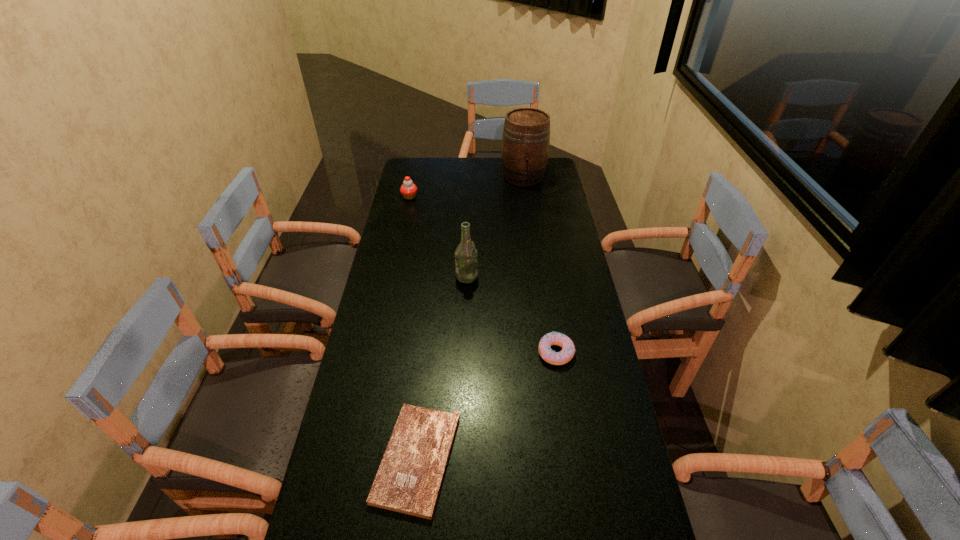
The image size is (960, 540). I want to click on cider, so click(x=526, y=135).

Where is `the farthest object`? the farthest object is located at coordinates (526, 135).

The width and height of the screenshot is (960, 540). In order to click on the fourth shortest object in this screenshot , I will do (x=466, y=262).

At what (x,y) coordinates should I click in order to perform the action: click on beer bottle. Please return your answer as a coordinate pair (x, y). Image resolution: width=960 pixels, height=540 pixels. Looking at the image, I should click on (466, 262).

Identify the location of the fourth nearest object. This screenshot has height=540, width=960. (408, 189).

I want to click on cupcake, so click(x=408, y=189).

Where is `the second nearest object`? The width and height of the screenshot is (960, 540). the second nearest object is located at coordinates click(547, 354).

You are a GUI agent. You are given a task and a screenshot of the screen. Output one action in this format:
    pyautogui.click(x=<x>, y=<y>)
    Task: Click on the doughnut
    Image resolution: width=960 pixels, height=540 pixels.
    Given the screenshot: What is the action you would take?
    pyautogui.click(x=547, y=354)

Image resolution: width=960 pixels, height=540 pixels. What are the coordinates of `the nearest object` in the screenshot? It's located at (409, 478).

Find the location of a particular element. Bible is located at coordinates pos(409,478).